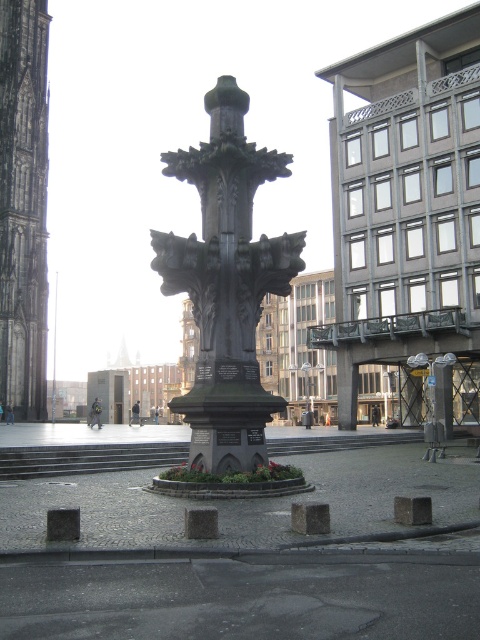
Question: Is dark gray stone fountain at center closer to camera compared to dark gray stone tower at left?

Choices:
 (A) no
 (B) yes

Answer: (B)

Question: Which point is closer to the camera?

Choices:
 (A) (40, 92)
 (B) (236, 461)

Answer: (B)

Question: Which of the following is the farthest from the observer?

Choices:
 (A) dark gray stone tower at left
 (B) dark gray stone fountain at center

Answer: (A)

Question: Which of the following is the closest to the observer?

Choices:
 (A) dark gray stone fountain at center
 (B) dark gray stone tower at left

Answer: (A)

Question: Does dark gray stone fountain at center lie in front of dark gray stone tower at left?

Choices:
 (A) no
 (B) yes

Answer: (B)

Question: Is dark gray stone fountain at center further to camera compared to dark gray stone tower at left?

Choices:
 (A) yes
 (B) no

Answer: (B)